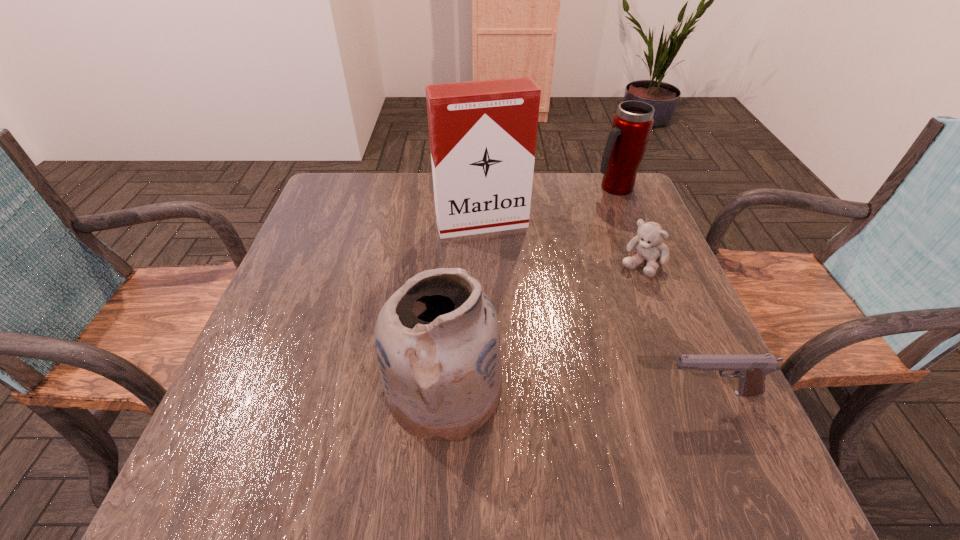
Find the location of a particular element. thermos bottle that is at the far edge is located at coordinates (632, 124).

The image size is (960, 540). I want to click on cigarette_case positioned at the far edge, so click(x=483, y=134).

Where is `pottery positioned at the near edge`? pottery positioned at the near edge is located at coordinates (437, 340).

Identify the location of pistol present at the near edge. The height and width of the screenshot is (540, 960). (751, 370).

The height and width of the screenshot is (540, 960). Identify the location of pistol situated at the right edge. (751, 370).

At what (x,y) coordinates should I click in order to perform the action: click on teddy bear that is at the right edge. Please return your answer as a coordinate pair (x, y). This screenshot has width=960, height=540. Looking at the image, I should click on (649, 245).

At what (x,y) coordinates should I click in order to perform the action: click on thermos bottle that is at the right edge. Please return your answer as a coordinate pair (x, y). Looking at the image, I should click on (632, 124).

What are the coordinates of `object that is at the far right corner` in the screenshot? It's located at pyautogui.click(x=632, y=124).

Find the location of `object that is at the near right corner`. object that is at the near right corner is located at coordinates (751, 370).

I want to click on vacant area at the far edge, so click(x=415, y=187).